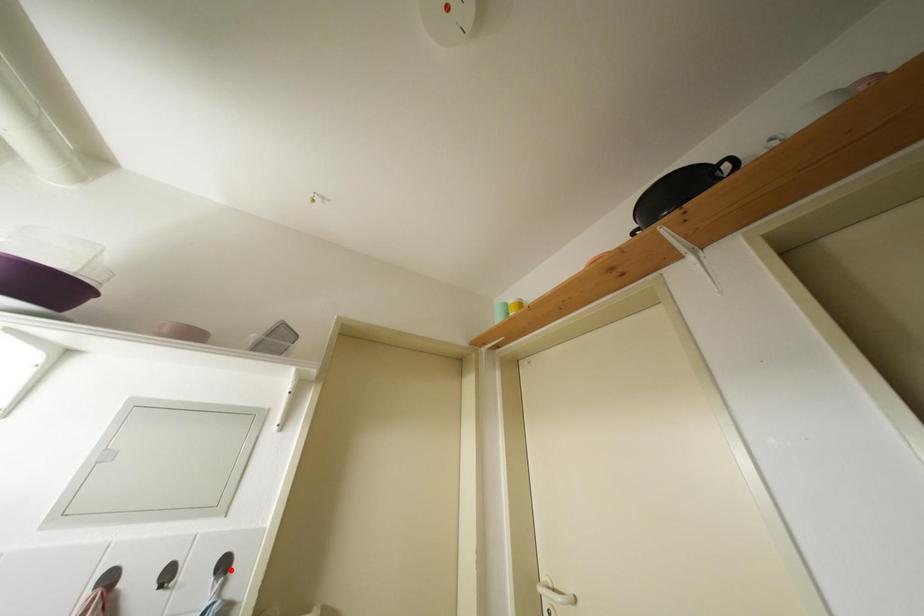
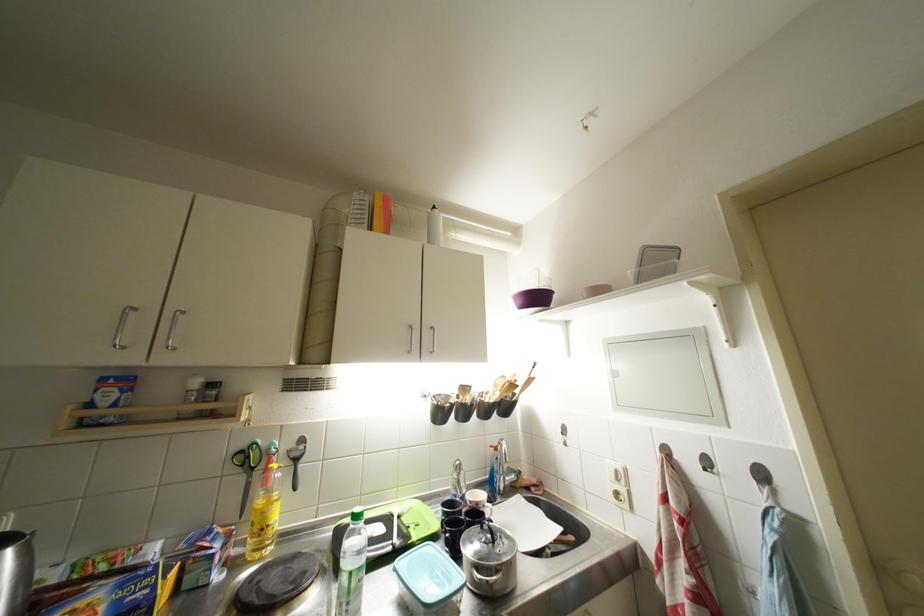
Locate, in the second image, the point that corresponds to the highlighted location in the first image.

(769, 479)